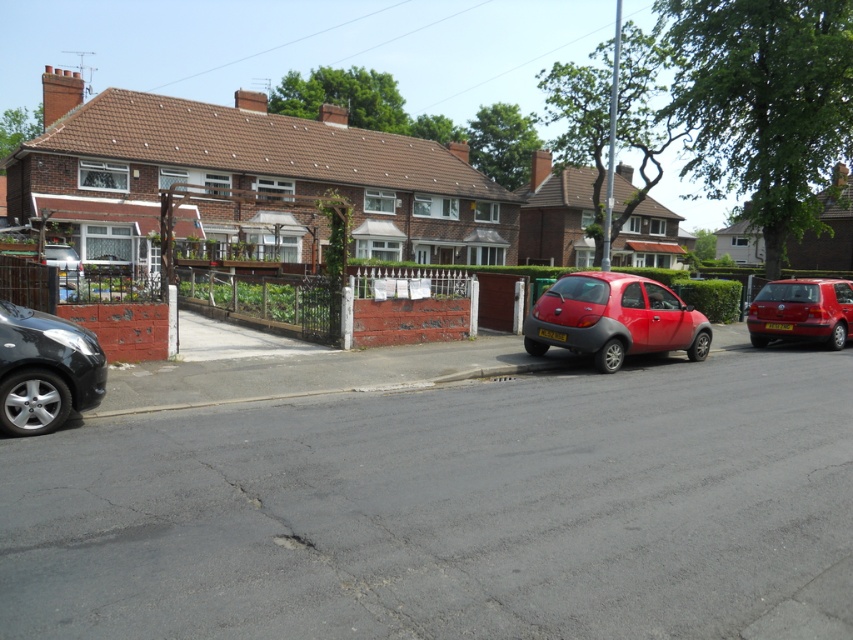
Based on the photo, you are a delivery person trying to park your van between the shiny red car at center and the metallic silver car at center. Can your van, which is 2.5 meters wide, fit in the space between them?

The shiny red car at center has a lesser width compared to metallic silver car at center, but without knowing the exact distance between them, it is impossible to determine if the 2.5 meter wide van can fit.

You are a delivery driver who needs to park your van between the shiny black car at lower left and the shiny red hatchback at right. Can you fit your van, which is 6 meters long, in the available space between them?

The shiny black car at lower left is smaller than the shiny red hatchback at right, but the description does not provide the exact distance between them. Without knowing the space between the two cars, it is impossible to determine if the van can fit.

You are a delivery driver who needs to park your van between the shiny black car at lower left and the shiny red hatchback at right. Can your van, which is 5 meters long, fit in the space between them?

The shiny black car at lower left is shorter than the shiny red hatchback at right, but the description does not provide the exact distance between them. Without knowing the space between the two cars, it is impossible to determine if the van can fit.